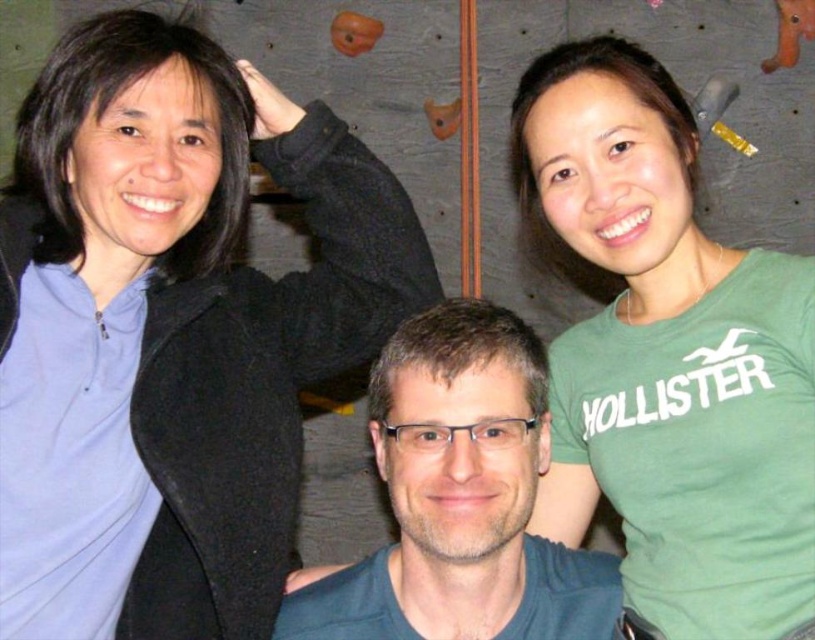
Is green cotton t-shirt at upper right below dark blue fabric at center?

Actually, green cotton t-shirt at upper right is above dark blue fabric at center.

Does green cotton t-shirt at upper right have a lesser width compared to dark blue fabric at center?

Yes, green cotton t-shirt at upper right is thinner than dark blue fabric at center.

Which is in front, point (626, 628) or point (571, 566)?

Point (571, 566) is more forward.

Image resolution: width=815 pixels, height=640 pixels. I want to click on green cotton t-shirt at upper right, so click(668, 358).

Locate an element on the screen. The width and height of the screenshot is (815, 640). matte black sweater at upper left is located at coordinates (210, 304).

Is matte black sweater at upper left positioned at the back of dark blue fabric at center?

Yes, matte black sweater at upper left is behind dark blue fabric at center.

You are a GUI agent. You are given a task and a screenshot of the screen. Output one action in this format:
    pyautogui.click(x=<x>, y=<y>)
    Task: Click on the matte black sweater at upper left
    This screenshot has width=815, height=640.
    Given the screenshot: What is the action you would take?
    pyautogui.click(x=210, y=304)

This screenshot has height=640, width=815. What are the coordinates of `matte black sweater at upper left` in the screenshot? It's located at (210, 304).

How far apart are matte black sweater at upper left and green cotton t-shirt at upper right?

matte black sweater at upper left and green cotton t-shirt at upper right are 16.64 inches apart from each other.

Between point (368, 326) and point (732, 561), which one is positioned in front?

Point (732, 561)

I want to click on matte black sweater at upper left, so click(210, 304).